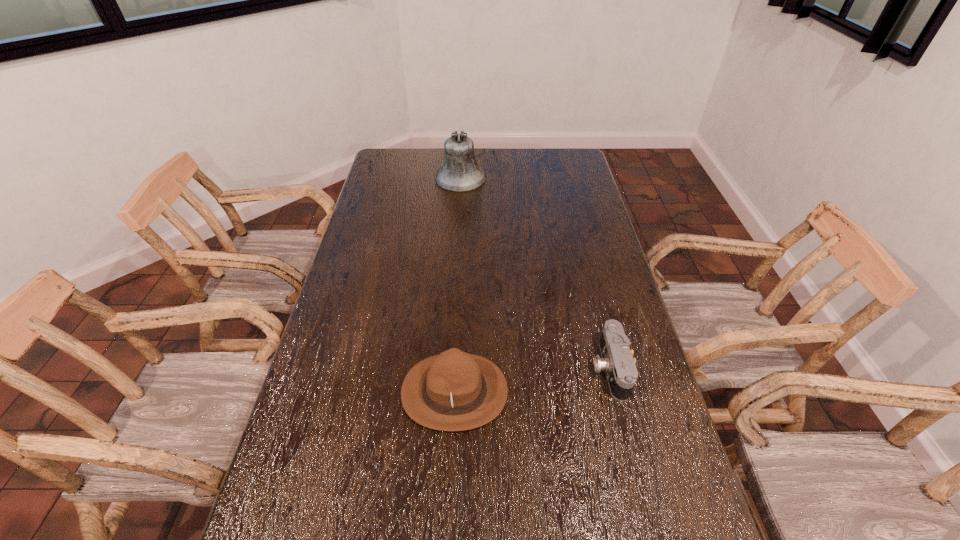
You are a GUI agent. You are given a task and a screenshot of the screen. Output one action in this format:
    pyautogui.click(x=<x>, y=<y>)
    Task: Click on the farthest object
    Image resolution: width=960 pixels, height=540 pixels.
    Given the screenshot: What is the action you would take?
    pyautogui.click(x=460, y=172)

Where is `the tallest object`? the tallest object is located at coordinates (460, 172).

This screenshot has width=960, height=540. I want to click on the second shortest object, so click(453, 391).

I want to click on the shortest object, so click(x=617, y=361).

The image size is (960, 540). Find the location of `camera`. camera is located at coordinates (617, 361).

The image size is (960, 540). What are the coordinates of `vacant position located 0.140m on the front of the tallest object` in the screenshot? It's located at (458, 212).

Image resolution: width=960 pixels, height=540 pixels. Find the location of `vacant region located on the feather side of the second shortest object`. vacant region located on the feather side of the second shortest object is located at coordinates (644, 392).

You are a GUI agent. You are given a task and a screenshot of the screen. Output one action in this format:
    pyautogui.click(x=<x>, y=<y>)
    Task: Click on the free space located on the lens of the rightmost object
    Image resolution: width=960 pixels, height=540 pixels.
    Given the screenshot: What is the action you would take?
    pyautogui.click(x=564, y=368)

In order to click on vacant area located 0.160m on the lens of the rightmost object in this screenshot , I will do `click(535, 368)`.

You are a GUI agent. You are given a task and a screenshot of the screen. Output one action in this format:
    pyautogui.click(x=<x>, y=<y>)
    Task: Click on the free spot located on the lens of the rightmost object
    Image resolution: width=960 pixels, height=540 pixels.
    Given the screenshot: What is the action you would take?
    pyautogui.click(x=506, y=368)